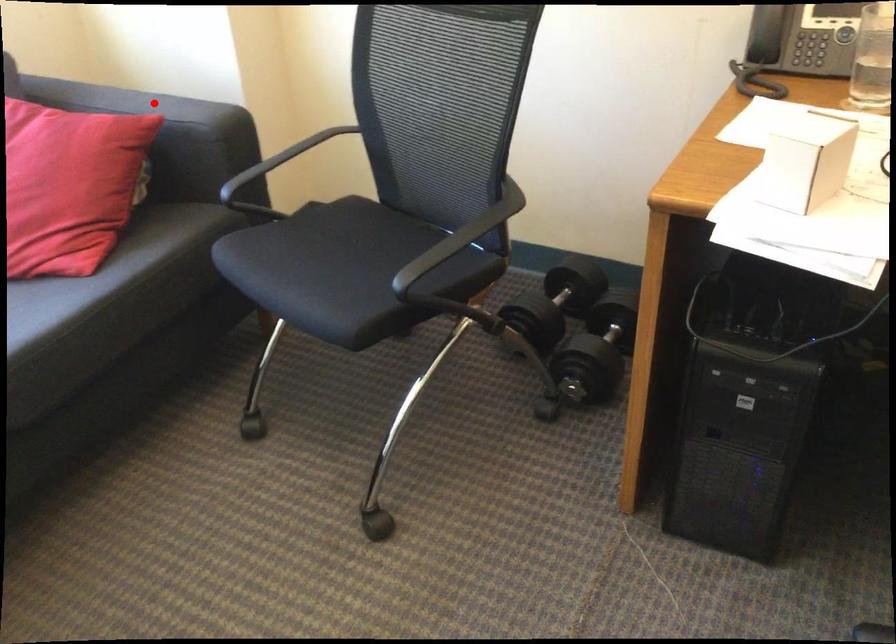
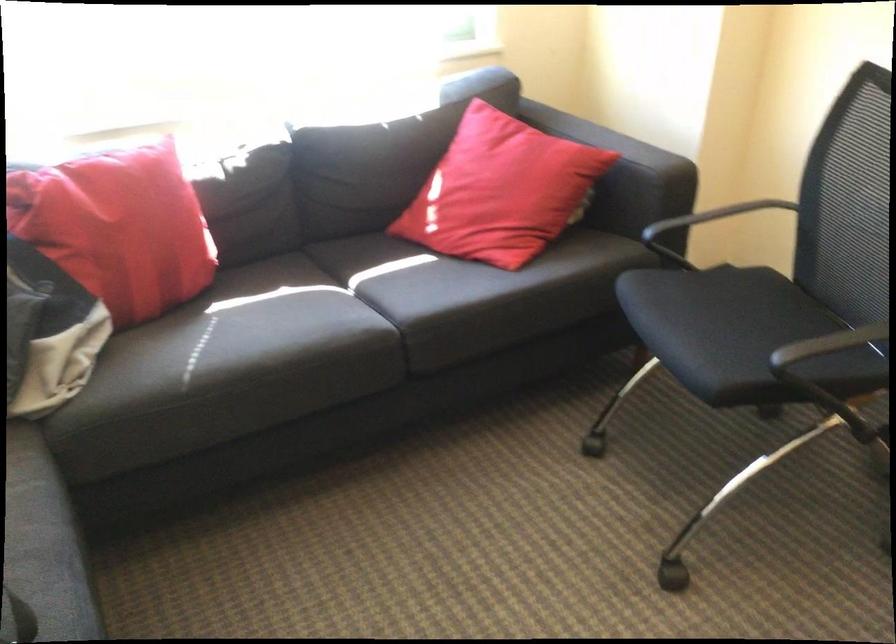
The point at the highlighted location is marked in the first image. Where is the corresponding point in the second image?

(616, 140)